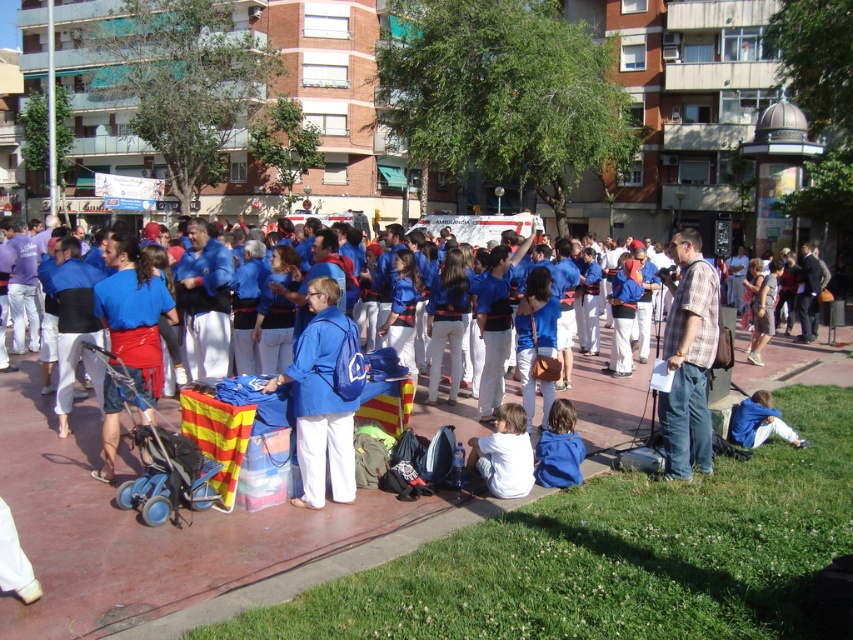
You are standing in the city square and see both the blue fabric at center and the blue fabric jacket at lower center. Which one is nearer to you?

The blue fabric at center is closer to the viewer than the blue fabric jacket at lower center.

You are a photographer trying to capture a candid shot of the blue fabric jacket at lower right without including the plaid fabric shirt at right in the frame. Based on their positions, is this possible?

The plaid fabric shirt at right is to the left of blue fabric jacket at lower right, so if you position yourself to the right side of the blue fabric jacket at lower right, you can capture the jacket without the plaid shirt in the frame.

You are organizing an outdoor event and need to place a sign on the blue fabric bag at center so it can be seen over the blue fabric jacket at lower right. Is the bag tall enough for the sign to be visible above the jacket?

The blue fabric bag at center has a greater height compared to the blue fabric jacket at lower right, so placing the sign on the bag would allow it to be seen above the jacket.